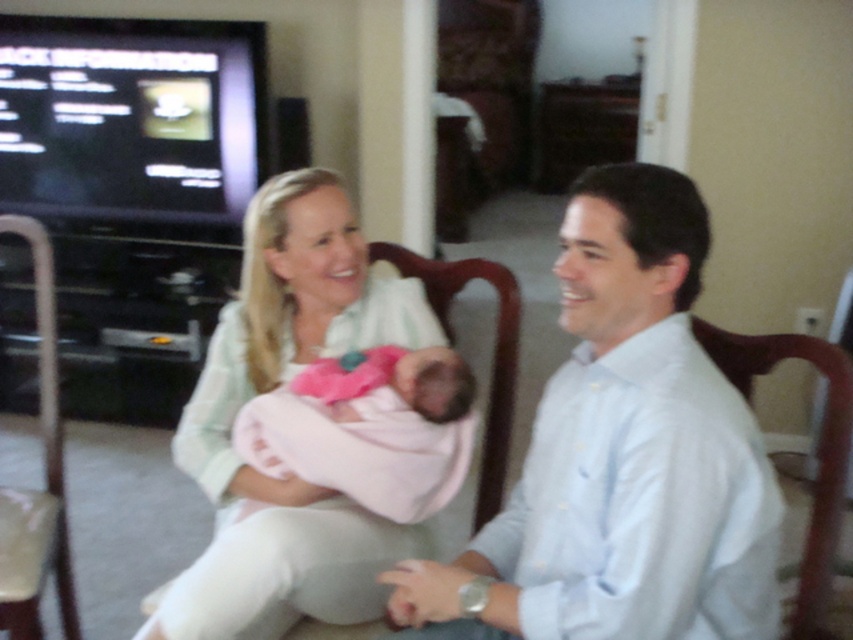
You are a tailor measuring clothes for a customer. You need to determine which item, the light blue shirt at right or the pink fabric newborn at center, requires a wider fabric width. Based on the image, which one should you prioritize for a wider fabric?

The light blue shirt at right requires a wider fabric width since its width surpasses that of the pink fabric newborn at center.

You are a photographer in the living room and want to take a picture of the light blue shirt at right and the light green fabric shirt at center. Which shirt is located to the right of the other?

The light blue shirt at right is positioned on the right side of the light green fabric shirt at center.

You are a photographer taking a portrait of the light green fabric shirt at center and the pink fabric newborn at center. Which object should you focus on first if you want to capture both in sharp focus?

The light green fabric shirt at center is located above the pink fabric newborn at center, so you should focus on the pink fabric newborn at center first to ensure both are in sharp focus since it is closer to the camera.